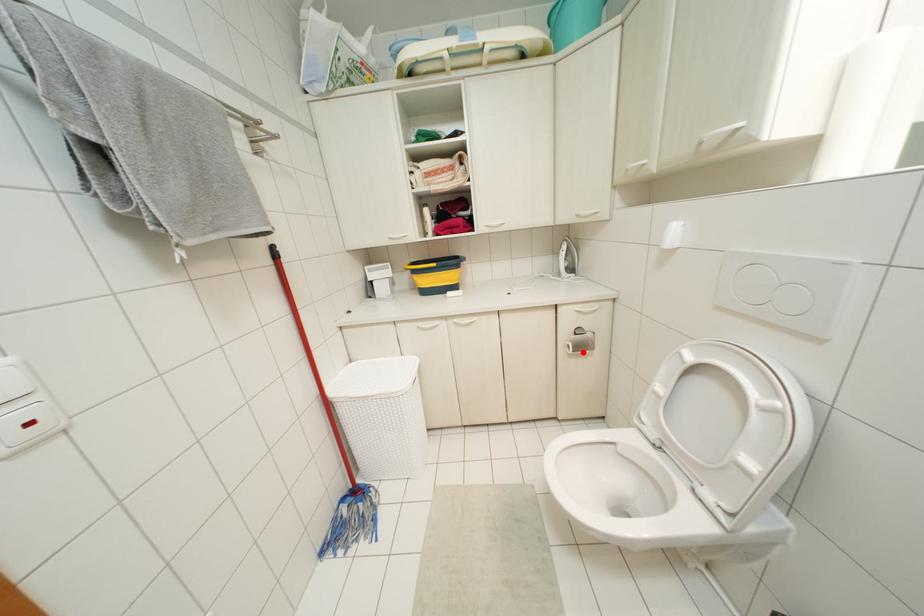
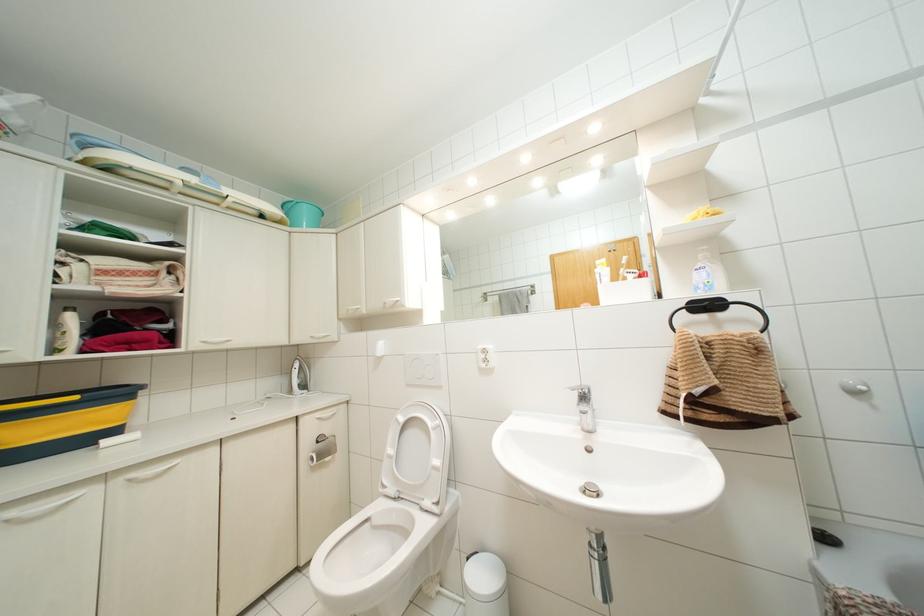
Question: I am providing you with two images of the same scene from different viewpoints. A red point is marked on the first image. Can you still see the location of the red point in image 2?

Choices:
 (A) Yes
 (B) No

Answer: (A)